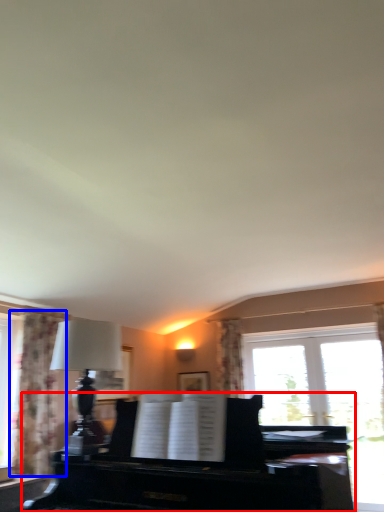
Question: Among these objects, which one is nearest to the camera, piano (highlighted by a red box) or curtain (highlighted by a blue box)?

Choices:
 (A) piano
 (B) curtain

Answer: (A)